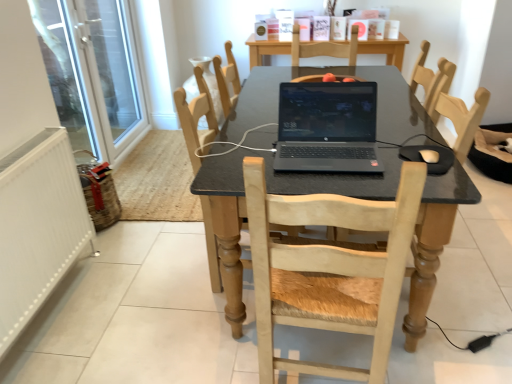
Where is `vacant area that is situated to the right of black matte laptop at center`? vacant area that is situated to the right of black matte laptop at center is located at coordinates (401, 146).